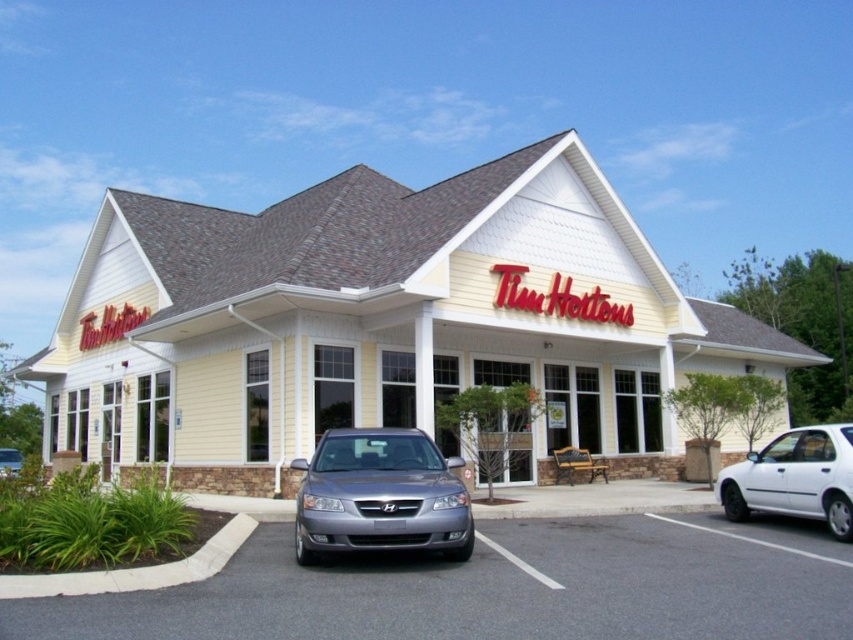
Question: Which point appears farthest from the camera in this image?

Choices:
 (A) coord(311,476)
 (B) coord(757,474)
 (C) coord(294,566)

Answer: (B)

Question: Observing the image, what is the correct spatial positioning of satin metallic sedan at center in reference to white matte car at lower right?

Choices:
 (A) below
 (B) above

Answer: (A)

Question: Can you confirm if white matte car at lower right is positioned below satin silver sedan at lower left?

Choices:
 (A) no
 (B) yes

Answer: (A)

Question: Is gray asphalt parking lot at center positioned before white matte car at lower right?

Choices:
 (A) no
 (B) yes

Answer: (B)

Question: Which object is the farthest from the yellow siding at center?

Choices:
 (A) white matte car at lower right
 (B) satin metallic sedan at center

Answer: (A)

Question: Among these objects, which one is farthest from the camera?

Choices:
 (A) yellow siding at center
 (B) gray asphalt parking lot at center

Answer: (A)